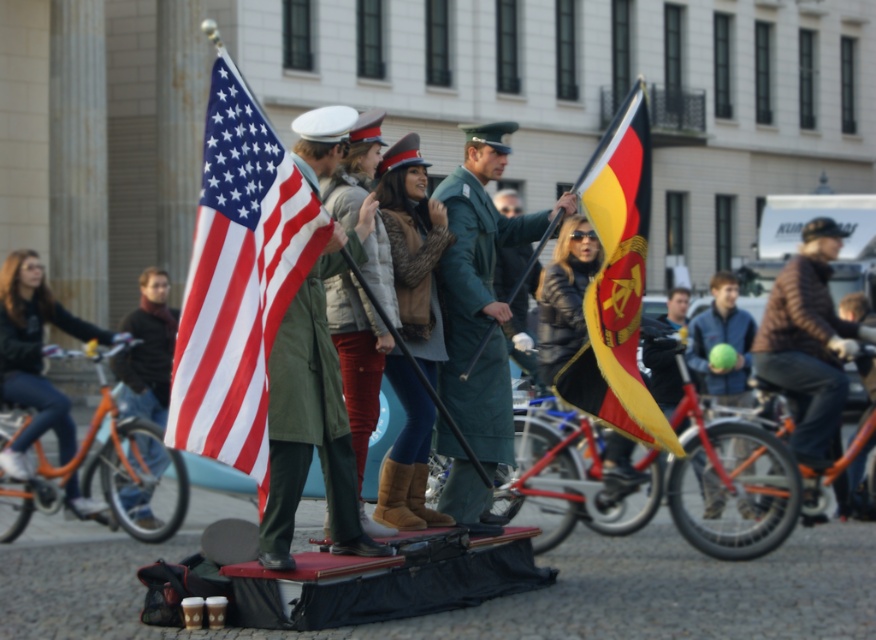
You are standing on the platform and want to reach both the point at coordinates point (x=618, y=454) and point (x=168, y=371). Which point should you go to first to minimize the distance walked?

You should go to point (x=618, y=454) first because it is closer to you than point (x=168, y=371).

You are a photographer trying to capture a clear shot of the leather boots at center and the dark gray sweater at left. Since you want to ensure both subjects are in focus, you need to know their relative heights. Which object is taller?

The leather boots at center is much taller than the dark gray sweater at left.